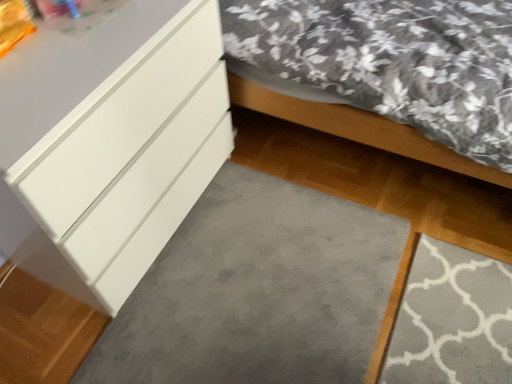
What do you see at coordinates (257, 291) in the screenshot? The width and height of the screenshot is (512, 384). I see `gray soft carpet at lower center` at bounding box center [257, 291].

You are a GUI agent. You are given a task and a screenshot of the screen. Output one action in this format:
    pyautogui.click(x=<x>, y=<y>)
    Task: Click on the matte white bed at lower left
    This screenshot has height=384, width=512.
    Given the screenshot: What is the action you would take?
    pyautogui.click(x=386, y=73)

Locate an element on the screen. This screenshot has width=512, height=384. gray soft carpet at lower center is located at coordinates (257, 291).

Is matte white bed at lower left in contact with white glossy chest of drawers at left?

There is a gap between matte white bed at lower left and white glossy chest of drawers at left.

From the image's perspective, which is below, matte white bed at lower left or white glossy chest of drawers at left?

white glossy chest of drawers at left, from the image's perspective.

Is the depth of matte white bed at lower left less than that of white glossy chest of drawers at left?

No, it is not.

Is point (372, 93) more distant than point (106, 92)?

Yes, it is.

Which object is thinner, gray soft carpet at lower center or white glossy chest of drawers at left?

white glossy chest of drawers at left is thinner.

Can you confirm if gray soft carpet at lower center is taller than white glossy chest of drawers at left?

No.

Is gray soft carpet at lower center facing towards white glossy chest of drawers at left?

No, gray soft carpet at lower center is not turned towards white glossy chest of drawers at left.

Looking at this image, which of these two, matte white bed at lower left or gray soft carpet at lower center, stands shorter?

gray soft carpet at lower center is shorter.

Is matte white bed at lower left turned away from gray soft carpet at lower center?

No.

Is point (449, 97) positioned in front of point (317, 284)?

Yes, it is in front of point (317, 284).

From the image's perspective, which one is positioned lower, gray soft carpet at lower center or matte white bed at lower left?

gray soft carpet at lower center is shown below in the image.

Is gray soft carpet at lower center beside matte white bed at lower left?

No.

Who is taller, gray soft carpet at lower center or matte white bed at lower left?

matte white bed at lower left.

Is gray soft carpet at lower center looking in the opposite direction of matte white bed at lower left?

No, gray soft carpet at lower center's orientation is not away from matte white bed at lower left.

From the picture: Is matte white bed at lower left inside white glossy chest of drawers at left?

No, matte white bed at lower left is not inside white glossy chest of drawers at left.

Between point (119, 194) and point (428, 79), which one is positioned in front?

The point (119, 194) is closer to the camera.

Relative to matte white bed at lower left, is white glossy chest of drawers at left in front or behind?

white glossy chest of drawers at left is in front of matte white bed at lower left.

From a real-world perspective, who is located higher, white glossy chest of drawers at left or gray soft carpet at lower center?

From a 3D spatial view, white glossy chest of drawers at left is above.

Is white glossy chest of drawers at left facing away from gray soft carpet at lower center?

No, gray soft carpet at lower center is not at the back of white glossy chest of drawers at left.

Would you say white glossy chest of drawers at left is a long distance from gray soft carpet at lower center?

No, white glossy chest of drawers at left is not far away from gray soft carpet at lower center.

Which is nearer, (x=208, y=51) or (x=176, y=342)?

Point (x=208, y=51) is closer to the camera than point (x=176, y=342).

This screenshot has width=512, height=384. Find the location of `chest of drawers on the left of matte white bed at lower left`. chest of drawers on the left of matte white bed at lower left is located at coordinates (116, 138).

Locate an element on the screen. The image size is (512, 384). concrete below the white glossy chest of drawers at left (from a real-world perspective) is located at coordinates (257, 291).

From the picture: Based on their spatial positions, is gray soft carpet at lower center or matte white bed at lower left further from white glossy chest of drawers at left?

matte white bed at lower left is positioned further to the anchor white glossy chest of drawers at left.

Which object lies nearer to the anchor point matte white bed at lower left, gray soft carpet at lower center or white glossy chest of drawers at left?

white glossy chest of drawers at left.

Estimate the real-world distances between objects in this image. Which object is further from matte white bed at lower left, white glossy chest of drawers at left or gray soft carpet at lower center?

The object further to matte white bed at lower left is gray soft carpet at lower center.

Based on their spatial positions, is white glossy chest of drawers at left or matte white bed at lower left closer to gray soft carpet at lower center?

The object closer to gray soft carpet at lower center is white glossy chest of drawers at left.

When comparing their distances from white glossy chest of drawers at left, does matte white bed at lower left or gray soft carpet at lower center seem further?

matte white bed at lower left is positioned further to the anchor white glossy chest of drawers at left.

Estimate the real-world distances between objects in this image. Which object is further from gray soft carpet at lower center, matte white bed at lower left or white glossy chest of drawers at left?

Among the two, matte white bed at lower left is located further to gray soft carpet at lower center.

Locate an element on the screen. The height and width of the screenshot is (384, 512). chest of drawers between matte white bed at lower left and gray soft carpet at lower center in the vertical direction is located at coordinates (116, 138).